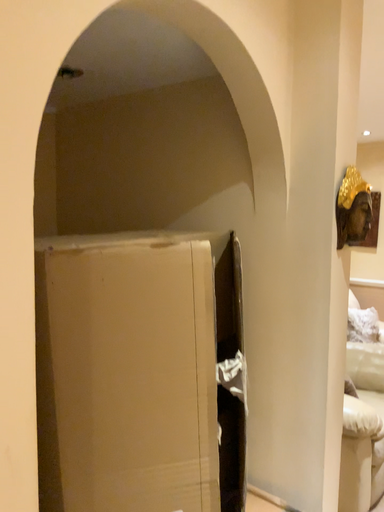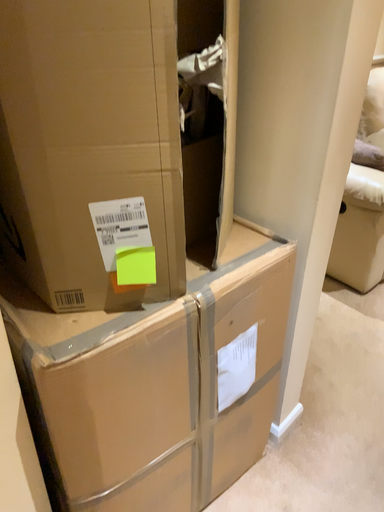
Question: How did the camera likely rotate when shooting the video?

Choices:
 (A) rotated left
 (B) rotated right

Answer: (A)